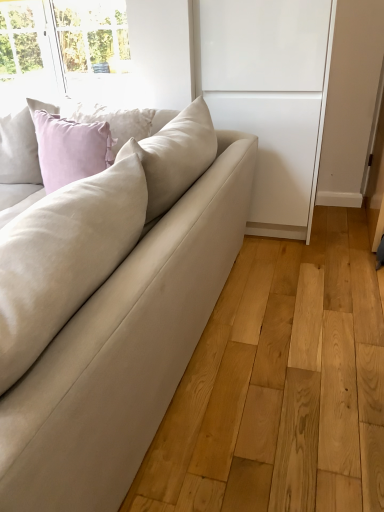
Question: From a real-world perspective, is white matte cabinet at center physically located above or below beige fabric couch at center?

Choices:
 (A) above
 (B) below

Answer: (A)

Question: Visually, is white matte cabinet at center positioned to the left or to the right of beige fabric couch at center?

Choices:
 (A) right
 (B) left

Answer: (A)

Question: Would you say white matte cabinet at center is inside or outside beige fabric couch at center?

Choices:
 (A) inside
 (B) outside

Answer: (B)

Question: In the image, is beige fabric couch at center positioned in front of or behind white matte cabinet at center?

Choices:
 (A) behind
 (B) front

Answer: (B)

Question: From a real-world perspective, relative to white matte cabinet at center, is beige fabric couch at center vertically above or below?

Choices:
 (A) above
 (B) below

Answer: (B)

Question: Visually, is beige fabric couch at center positioned to the left or to the right of white matte cabinet at center?

Choices:
 (A) left
 (B) right

Answer: (A)

Question: From the image's perspective, is beige fabric couch at center above or below white matte cabinet at center?

Choices:
 (A) above
 (B) below

Answer: (B)